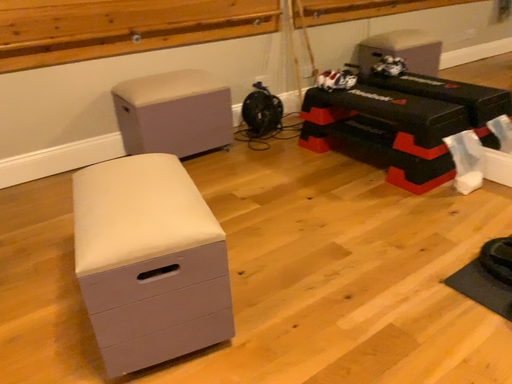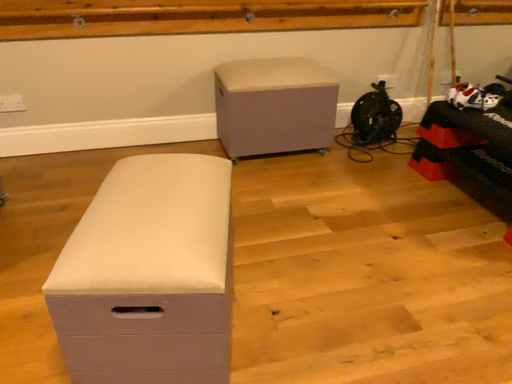
Question: How did the camera likely rotate when shooting the video?

Choices:
 (A) rotated right
 (B) rotated left

Answer: (B)